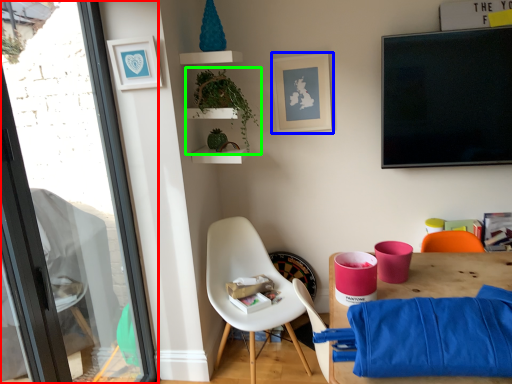
Question: Which is nearer to the window (highlighted by a red box)? picture frame (highlighted by a blue box) or houseplant (highlighted by a green box).

Choices:
 (A) picture frame
 (B) houseplant

Answer: (B)